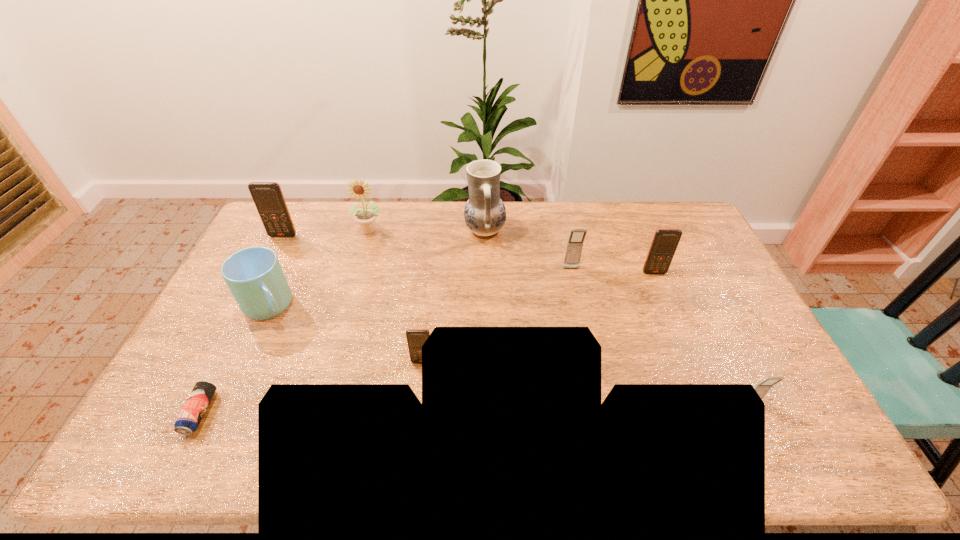
I want to click on object identified as the closest to the second smallest orange cellular telephone, so pos(577,236).

Locate an element on the screen. The height and width of the screenshot is (540, 960). object that is the fourth closest to the second orange cellular telephone from left to right is located at coordinates (577, 236).

What are the coordinates of `cellular telephone that is the fourth closest to the mug` in the screenshot? It's located at (665, 241).

This screenshot has height=540, width=960. I want to click on cellular telephone that can be found as the second closest to the smallest orange cellular telephone, so click(268, 197).

Identify which orange cellular telephone is the third nearest to the third cellular telephone from right to left. Please provide its 2D coordinates. Your answer should be formatted as a tuple, i.e. [(x, y)], where the tuple contains the x and y coordinates of a point satisfying the conditions above.

[(268, 197)]

Identify which orange cellular telephone is located as the nearest to the rightmost orange cellular telephone. Please provide its 2D coordinates. Your answer should be formatted as a tuple, i.e. [(x, y)], where the tuple contains the x and y coordinates of a point satisfying the conditions above.

[(416, 338)]